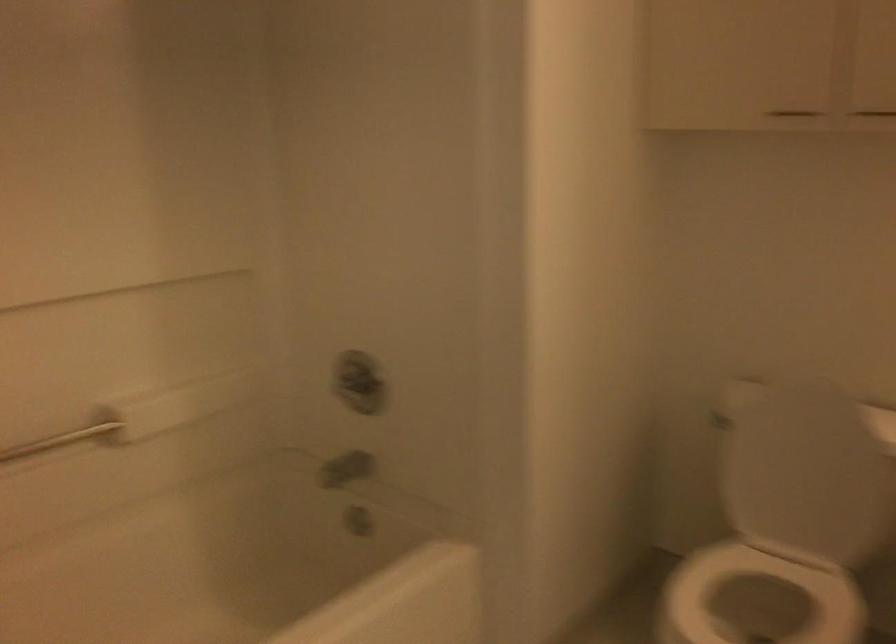
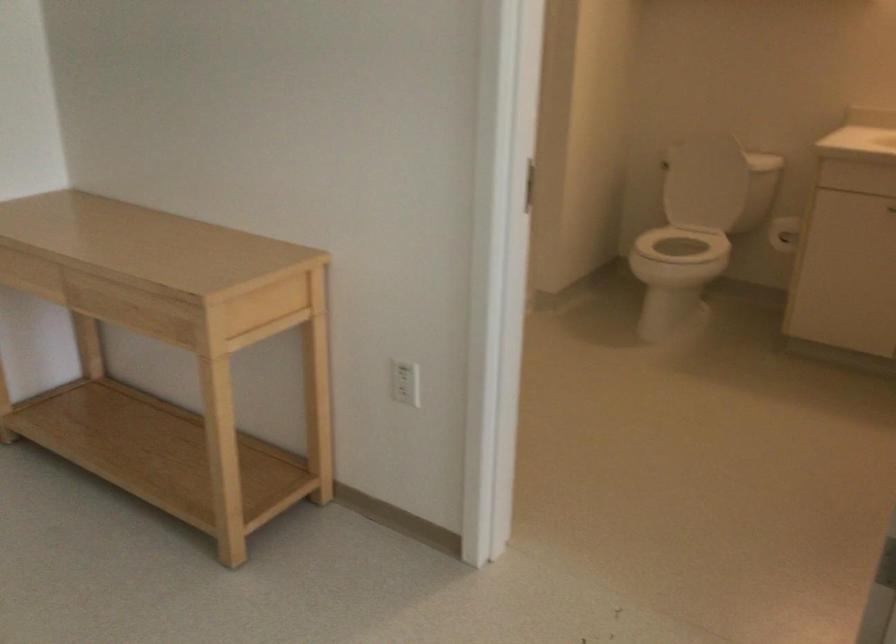
Which direction would the cameraman need to move to produce the second image?

The movement direction of the cameraman is left, backward.